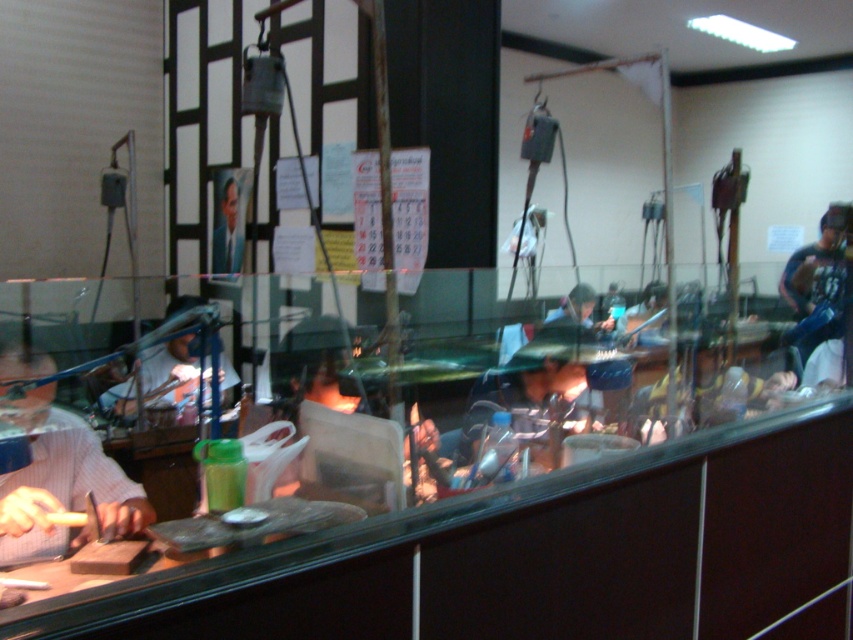
You are a visitor in this space and want to take a photo of the smooth skin face at center without including the dark blue jeans at right in the frame. Is it possible based on their sizes?

The dark blue jeans at right has a larger size compared to smooth skin face at center. Since the jeans are larger, they might occupy more space in the frame, making it harder to exclude them. However, adjusting the camera angle or zoom could allow focusing solely on the smooth skin face at center, avoiding the jeans.

You are standing in the workshop and want to place a new item on the counter. The counter has a dark wooden surface with items like the green plastic bottle, white plastic bag, and a cutting board with a knife. Where on the counter would you place the new item to avoid blocking the matte plastic glasses at left located at point (62, 484)?

Place the new item away from point (62, 484) where the matte plastic glasses at left are located to avoid blocking them.

You are organizing items on a counter and need to place the matte plastic glasses at left and the matte black laptop at center. According to the reflection in the glass, which item is positioned lower on the counter?

The matte plastic glasses at left is positioned lower on the counter than the matte black laptop at center, as it is located below it.